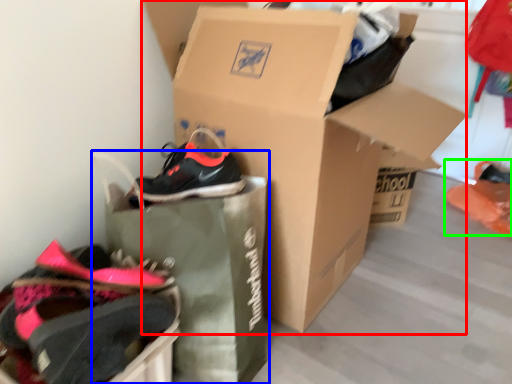
Question: Estimate the real-world distances between objects in this image. Which object is farther from box (highlighted by a red box), shopping bag (highlighted by a blue box) or footwear (highlighted by a green box)?

Choices:
 (A) shopping bag
 (B) footwear

Answer: (B)